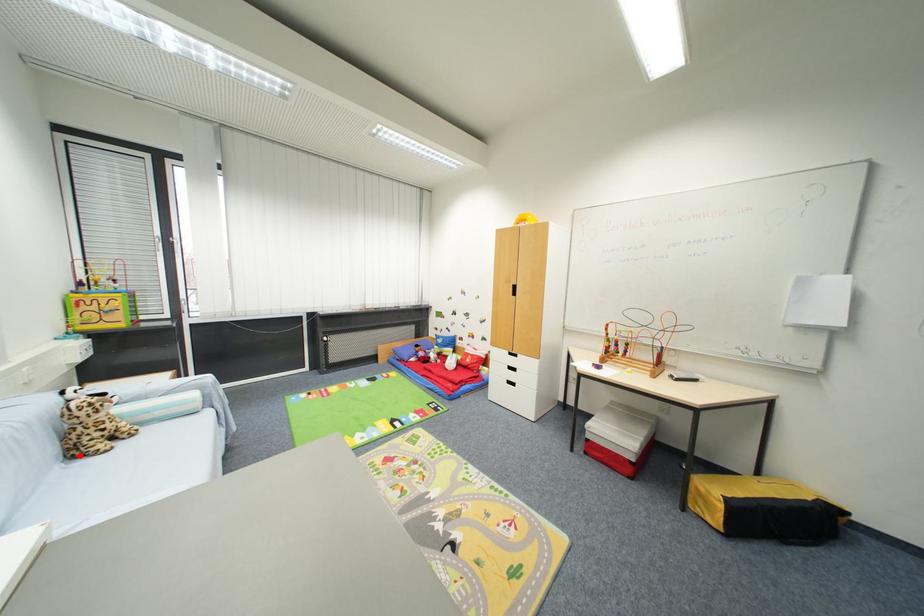
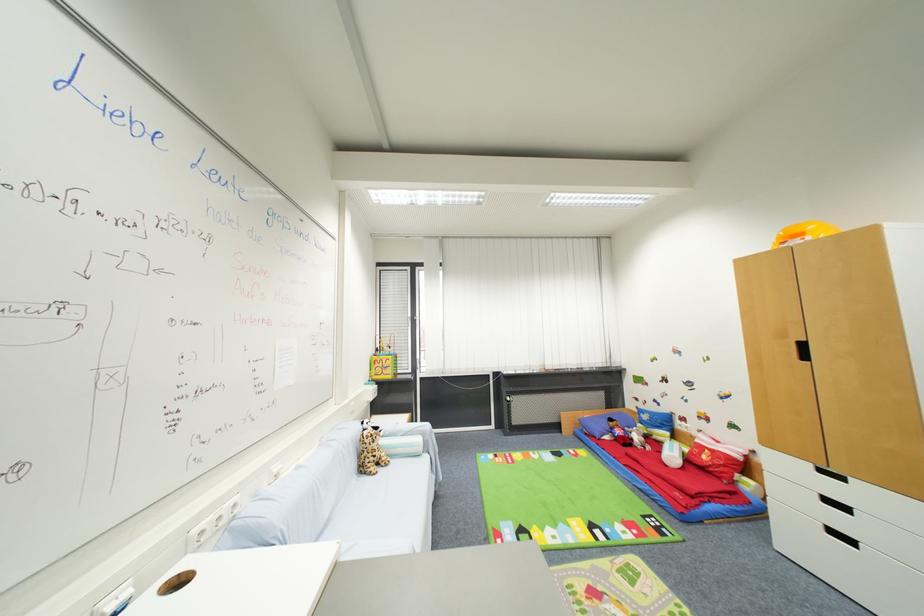
Locate, in the second image, the point that corresponds to the highlighted location in the first image.

(367, 472)